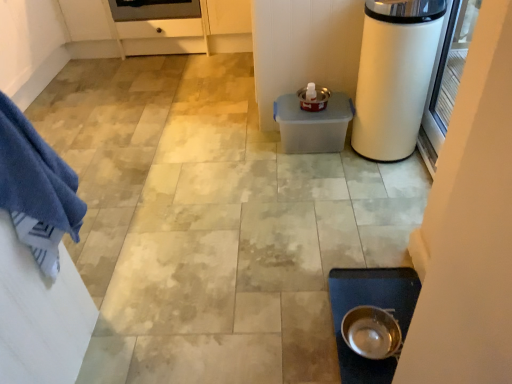
Question: Considering the relative sizes of white glossy trash can at right and blue cotton towel at left in the image provided, is white glossy trash can at right taller than blue cotton towel at left?

Choices:
 (A) no
 (B) yes

Answer: (B)

Question: From the image's perspective, is white glossy trash can at right on top of blue cotton towel at left?

Choices:
 (A) yes
 (B) no

Answer: (A)

Question: Does white glossy trash can at right have a lesser height compared to blue cotton towel at left?

Choices:
 (A) yes
 (B) no

Answer: (B)

Question: Is white glossy trash can at right directly adjacent to blue cotton towel at left?

Choices:
 (A) yes
 (B) no

Answer: (B)

Question: Can you confirm if white glossy trash can at right is wider than blue cotton towel at left?

Choices:
 (A) yes
 (B) no

Answer: (A)

Question: From the image's perspective, relative to white glossy trash can at right, is transparent glass screen door at right above or below?

Choices:
 (A) above
 (B) below

Answer: (B)

Question: In terms of height, does transparent glass screen door at right look taller or shorter compared to white glossy trash can at right?

Choices:
 (A) short
 (B) tall

Answer: (A)

Question: From a real-world perspective, is transparent glass screen door at right above or below white glossy trash can at right?

Choices:
 (A) above
 (B) below

Answer: (A)

Question: Considering the positions of transparent glass screen door at right and white glossy trash can at right in the image, is transparent glass screen door at right wider or thinner than white glossy trash can at right?

Choices:
 (A) wide
 (B) thin

Answer: (B)

Question: Is metallic silver bowl at lower center wider or thinner than blue cotton towel at left?

Choices:
 (A) wide
 (B) thin

Answer: (B)

Question: From the image's perspective, relative to blue cotton towel at left, is metallic silver bowl at lower center above or below?

Choices:
 (A) above
 (B) below

Answer: (B)

Question: Considering the positions of metallic silver bowl at lower center and blue cotton towel at left in the image, is metallic silver bowl at lower center taller or shorter than blue cotton towel at left?

Choices:
 (A) tall
 (B) short

Answer: (B)

Question: Visually, is metallic silver bowl at lower center positioned to the left or to the right of blue cotton towel at left?

Choices:
 (A) left
 (B) right

Answer: (B)

Question: From the image's perspective, relative to metallic silver bowl at lower center, is blue cotton towel at left above or below?

Choices:
 (A) above
 (B) below

Answer: (A)

Question: Is blue cotton towel at left spatially inside metallic silver bowl at lower center, or outside of it?

Choices:
 (A) inside
 (B) outside

Answer: (B)